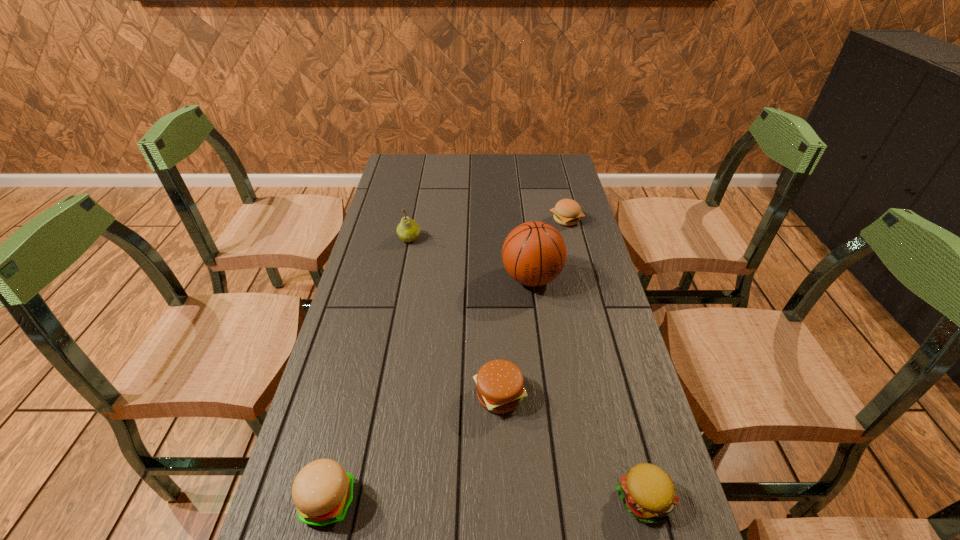
Locate an element on the screen. the tallest object is located at coordinates (534, 253).

In order to click on the third farthest object in this screenshot , I will do `click(534, 253)`.

At what (x,y) coordinates should I click in order to perform the action: click on the fifth shortest object. Please return your answer as a coordinate pair (x, y). The image size is (960, 540). Looking at the image, I should click on (408, 230).

The height and width of the screenshot is (540, 960). Find the location of `the fifth nearest object`. the fifth nearest object is located at coordinates (408, 230).

The height and width of the screenshot is (540, 960). In order to click on the fourth shortest object in this screenshot , I will do `click(322, 491)`.

Where is `the leftmost hamburger`? the leftmost hamburger is located at coordinates (322, 491).

At what (x,y) coordinates should I click in order to perform the action: click on the farthest object. Please return your answer as a coordinate pair (x, y). The width and height of the screenshot is (960, 540). Looking at the image, I should click on (567, 212).

In order to click on the second farthest hamburger in this screenshot , I will do `click(500, 389)`.

Identify the location of the second hamburger from left to right. Image resolution: width=960 pixels, height=540 pixels. (500, 389).

Where is `vacant area situated 0.100m on the back of the basketball`? vacant area situated 0.100m on the back of the basketball is located at coordinates (527, 239).